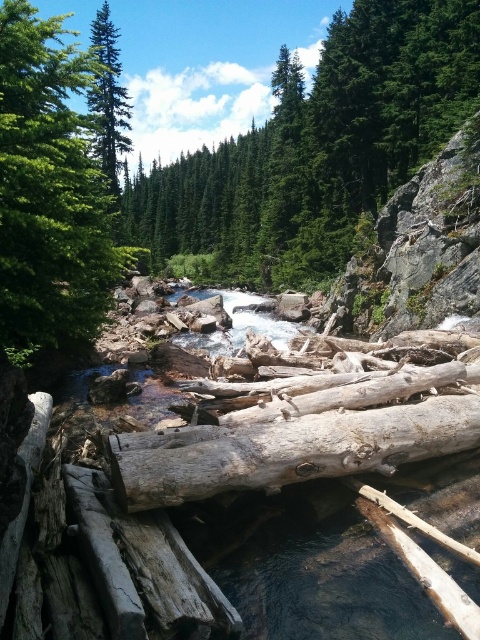
You are standing at the center of the river and want to reach the green textured tree at upper center. Which direction should you head towards?

The green textured tree at upper center is located at point [319,147], so you should head towards the upper direction to reach it.

You are planning to build a small wooden bridge over the river. The green textured tree at upper center and the weathered wood log at center are in your way. Which object should you move to make space for the bridge?

You should move the green textured tree at upper center because its width is larger than the weathered wood log at center, making it the bigger obstacle.

You are an environmental scientist studying tree growth in this forest. You observe the green textured tree at upper left and the green matte tree at upper left. Which tree has a greater width according to your measurements?

The green textured tree at upper left has a greater width than the green matte tree at upper left.